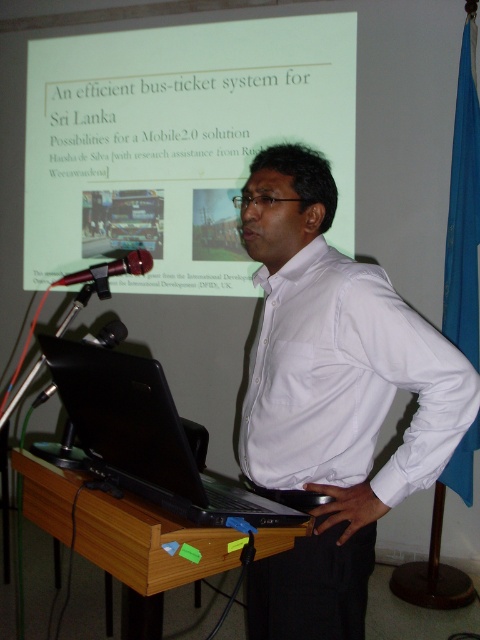
Is white paper at upper center closer to the viewer compared to brown wooden podium at center?

No, it is behind brown wooden podium at center.

Does white paper at upper center have a lesser width compared to brown wooden podium at center?

No.

Does point (268, 104) come closer to viewer compared to point (74, 522)?

No.

Image resolution: width=480 pixels, height=640 pixels. I want to click on white paper at upper center, so click(x=178, y=141).

Who is positioned more to the right, white smooth shirt at center or black matte laptop at lower left?

white smooth shirt at center is more to the right.

I want to click on white smooth shirt at center, so click(332, 397).

Image resolution: width=480 pixels, height=640 pixels. Describe the element at coordinates (332, 397) in the screenshot. I see `white smooth shirt at center` at that location.

Locate an element on the screen. white smooth shirt at center is located at coordinates (332, 397).

Between white paper at upper center and black matte laptop at lower left, which one has less height?

With less height is black matte laptop at lower left.

Which is behind, point (206, 132) or point (157, 396)?

Positioned behind is point (206, 132).

You are a GUI agent. You are given a task and a screenshot of the screen. Output one action in this format:
    pyautogui.click(x=<x>, y=<y>)
    Task: Click on the white paper at upper center
    
    Given the screenshot: What is the action you would take?
    pyautogui.click(x=178, y=141)